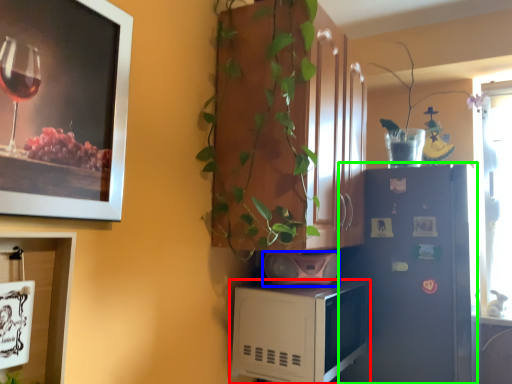
Question: Which object is the farthest from microwave oven (highlighted by a red box)? Choose among these: appliance (highlighted by a blue box) or refrigerator (highlighted by a green box).

Choices:
 (A) appliance
 (B) refrigerator

Answer: (B)